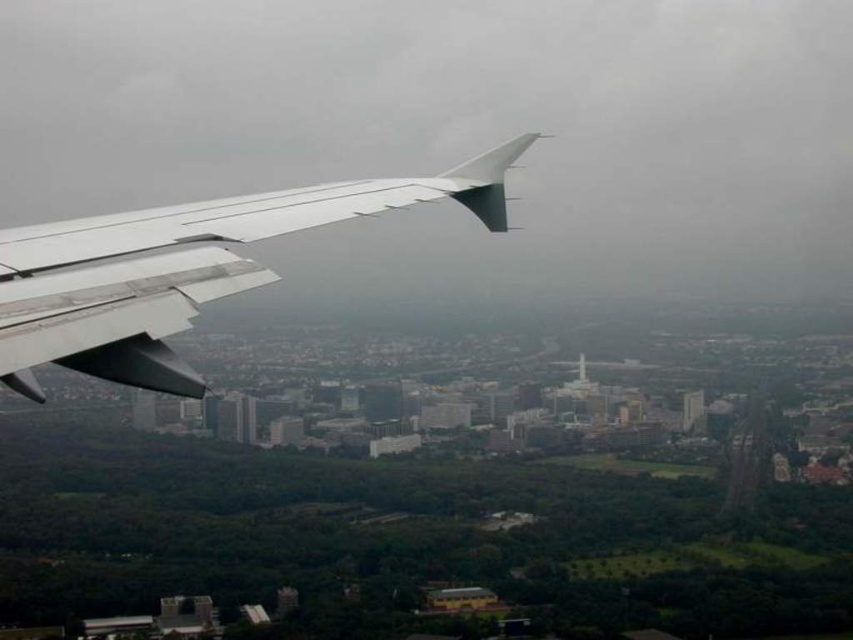
You are a flight attendant on an airplane and notice two wings visible from your window seat. The scene shows a white matte wing at left and a metallic silver wing at left. Which of these two wings appears bigger in the image?

The white matte wing at left has a larger size compared to the metallic silver wing at left, so the white matte wing at left appears bigger in the image.

You are a passenger on the airplane and want to take a photo of the city below. You notice two points in the scene labeled as point 1 at coordinates point (351, 234) and point 2 at coordinates point (119, 316). Which point is closer to the airplane window where you are taking the photo?

Point (351, 234) is closer to the viewer than point (119, 316), so the point (351, 234) is closer to the airplane window where you are taking the photo.